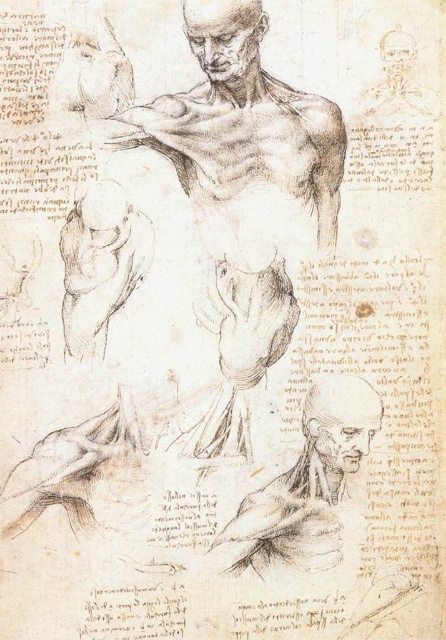
Question: Among these points, which one is nearest to the camera?

Choices:
 (A) (350, 406)
 (B) (350, 419)
 (C) (232, 340)
 (D) (194, 4)

Answer: (D)

Question: Is smooth gray head at lower right below smooth gray head at upper center?

Choices:
 (A) no
 (B) yes

Answer: (B)

Question: Which of these objects is positioned farthest from the brown paper sketch of man at center?

Choices:
 (A) smooth gray head at upper center
 (B) grayish pencil sketch of head at lower right

Answer: (B)

Question: Can you confirm if smooth gray head at lower right is positioned below smooth gray head at upper center?

Choices:
 (A) yes
 (B) no

Answer: (A)

Question: Based on their relative distances, which object is nearer to the smooth gray head at upper center?

Choices:
 (A) smooth gray head at lower right
 (B) grayish pencil sketch of head at lower right
 (C) brown paper sketch of man at center

Answer: (C)

Question: Is the position of smooth gray head at lower right more distant than that of grayish pencil sketch of head at lower right?

Choices:
 (A) no
 (B) yes

Answer: (A)